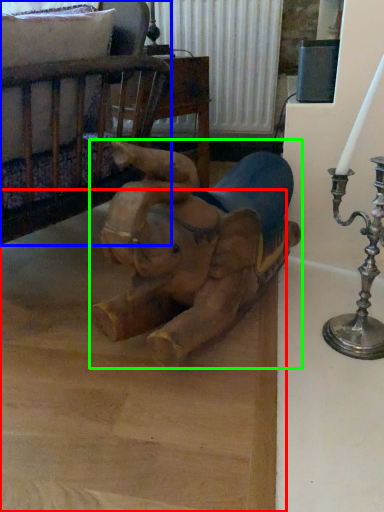
Question: Considering the real-world distances, which object is farthest from cardboard (highlighted by a red box)? furniture (highlighted by a blue box) or toy (highlighted by a green box)?

Choices:
 (A) furniture
 (B) toy

Answer: (A)